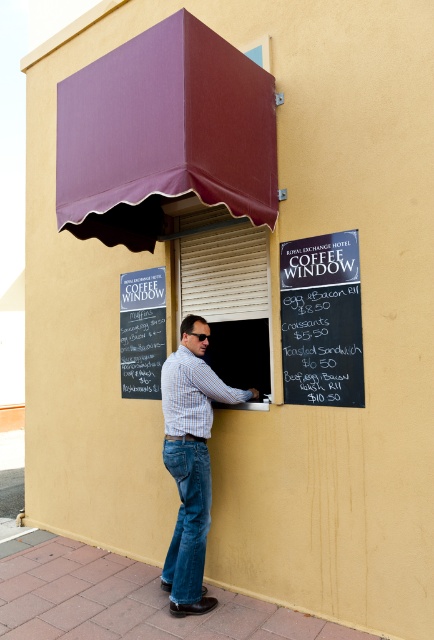
You are standing in front of the coffee window at the Royal Exchange Hotel and notice two points marked on the window. The first point is at coordinates point (357,248) and the second is at point (134,312). Which point is closer to your current position?

Point (357,248) is closer to the camera than point (134,312), so the first point is closer to your current position.